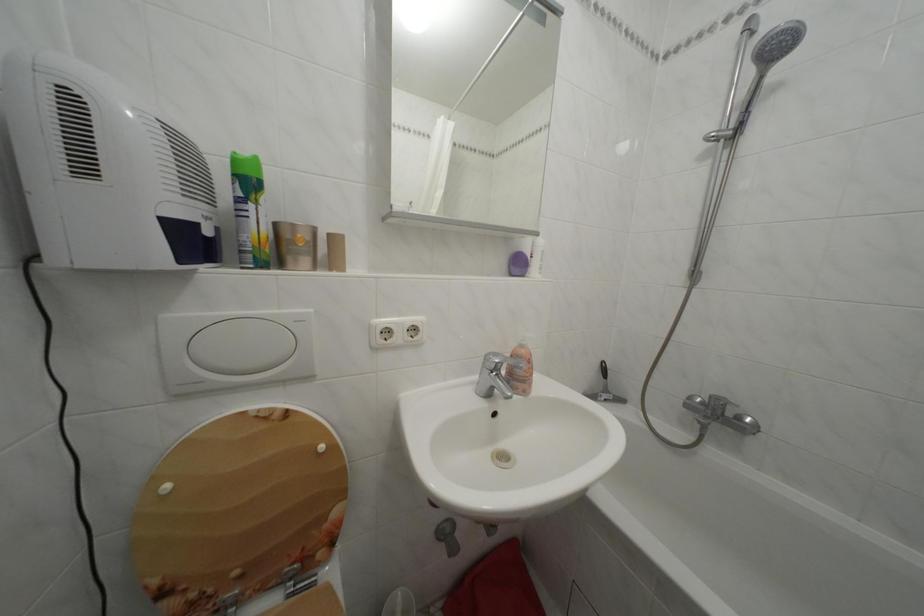
The image size is (924, 616). What do you see at coordinates (696, 276) in the screenshot?
I see `a shower diverter lever` at bounding box center [696, 276].